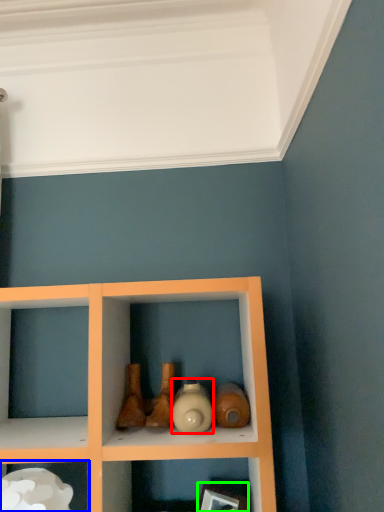
Question: Based on their relative distances, which object is nearer to bottle (highlighted by a red box)? Choose from shelf (highlighted by a blue box) and picture frame (highlighted by a green box).

Choices:
 (A) shelf
 (B) picture frame

Answer: (B)